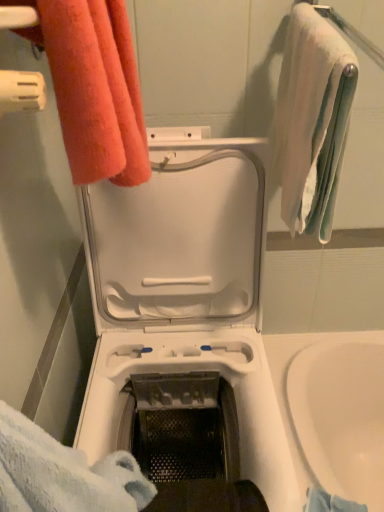
Measure the distance between point (109, 94) and camera.

The depth of point (109, 94) is 19.21 inches.

Measure the distance between white plastic washing machine at center and camera.

The distance of white plastic washing machine at center from camera is 66.30 centimeters.

Identify the location of white soft towel at upper right, which is counted as the 1th towel, starting from the right. (312, 120).

Does white soft towel at upper right, which is counted as the 1th towel, starting from the right, appear on the left side of orange terry cloth towel at upper left, the second towel in the right-to-left sequence?

Incorrect, white soft towel at upper right, which is counted as the 1th towel, starting from the right, is not on the left side of orange terry cloth towel at upper left, the second towel in the right-to-left sequence.

From the image's perspective, between white soft towel at upper right, arranged as the second towel when viewed from the left, and orange terry cloth towel at upper left, the second towel in the right-to-left sequence, which one is located above?

white soft towel at upper right, arranged as the second towel when viewed from the left.

Is white soft towel at upper right, arranged as the second towel when viewed from the left, in front of or behind orange terry cloth towel at upper left, positioned as the 1th towel in left-to-right order, in the image?

white soft towel at upper right, arranged as the second towel when viewed from the left, is positioned farther from the viewer than orange terry cloth towel at upper left, positioned as the 1th towel in left-to-right order.

Does point (339, 129) come farther from viewer compared to point (40, 15)?

Yes, point (339, 129) is behind point (40, 15).

From a real-world perspective, which object stands above the other?

white soft towel at upper right, which is counted as the 1th towel, starting from the right, is physically above.

Does point (197, 141) come farther from viewer compared to point (313, 106)?

Yes, point (197, 141) is farther from viewer.

From the image's perspective, which one is positioned higher, white plastic washing machine at center or white soft towel at upper right, which is counted as the 1th towel, starting from the right?

white soft towel at upper right, which is counted as the 1th towel, starting from the right, appears higher in the image.

Identify the location of the 1st towel above the white plastic washing machine at center (from a real-world perspective). This screenshot has height=512, width=384. (312, 120).

Is white plastic washing machine at center not inside orange terry cloth towel at upper left, the second towel in the right-to-left sequence?

Yes, white plastic washing machine at center is outside of orange terry cloth towel at upper left, the second towel in the right-to-left sequence.

Considering the relative sizes of white plastic washing machine at center and orange terry cloth towel at upper left, positioned as the 1th towel in left-to-right order, in the image provided, is white plastic washing machine at center wider than orange terry cloth towel at upper left, positioned as the 1th towel in left-to-right order,?

Correct, the width of white plastic washing machine at center exceeds that of orange terry cloth towel at upper left, positioned as the 1th towel in left-to-right order.

From a real-world perspective, who is located lower, white plastic washing machine at center or orange terry cloth towel at upper left, the second towel in the right-to-left sequence?

From a 3D spatial view, white plastic washing machine at center is below.

Is orange terry cloth towel at upper left, the second towel in the right-to-left sequence, at the back of white plastic washing machine at center?

white plastic washing machine at center is not turned away from orange terry cloth towel at upper left, the second towel in the right-to-left sequence.

Based on the photo, is orange terry cloth towel at upper left, the second towel in the right-to-left sequence, not within white plastic washing machine at center?

Absolutely, orange terry cloth towel at upper left, the second towel in the right-to-left sequence, is external to white plastic washing machine at center.

From the image's perspective, is orange terry cloth towel at upper left, positioned as the 1th towel in left-to-right order, located beneath white plastic washing machine at center?

Incorrect, from the image's perspective, orange terry cloth towel at upper left, positioned as the 1th towel in left-to-right order, is higher than white plastic washing machine at center.

Who is taller, orange terry cloth towel at upper left, positioned as the 1th towel in left-to-right order, or white plastic washing machine at center?

white plastic washing machine at center.

Is point (298, 216) less distant than point (241, 193)?

Yes, point (298, 216) is closer to viewer.

Considering the sizes of objects white soft towel at upper right, which is counted as the 1th towel, starting from the right, and white plastic washing machine at center in the image provided, who is bigger, white soft towel at upper right, which is counted as the 1th towel, starting from the right, or white plastic washing machine at center?

Bigger between the two is white plastic washing machine at center.

Considering their positions, is white soft towel at upper right, which is counted as the 1th towel, starting from the right, located in front of or behind white plastic washing machine at center?

white soft towel at upper right, which is counted as the 1th towel, starting from the right, is behind white plastic washing machine at center.

From a real-world perspective, who is located higher, white soft towel at upper right, arranged as the second towel when viewed from the left, or white plastic washing machine at center?

white soft towel at upper right, arranged as the second towel when viewed from the left.

What's the angular difference between orange terry cloth towel at upper left, positioned as the 1th towel in left-to-right order, and white soft towel at upper right, which is counted as the 1th towel, starting from the right,'s facing directions?

The angle between the facing direction of orange terry cloth towel at upper left, positioned as the 1th towel in left-to-right order, and the facing direction of white soft towel at upper right, which is counted as the 1th towel, starting from the right, is 9.14e-05 degrees.

Which point is more forward, (82,163) or (325,36)?

Positioned in front is point (82,163).

In the scene shown: Does orange terry cloth towel at upper left, the second towel in the right-to-left sequence, have a smaller size compared to white soft towel at upper right, which is counted as the 1th towel, starting from the right?

Indeed, orange terry cloth towel at upper left, the second towel in the right-to-left sequence, has a smaller size compared to white soft towel at upper right, which is counted as the 1th towel, starting from the right.

At what (x,y) coordinates should I click in order to perform the action: click on towel above the white soft towel at upper right, which is counted as the 1th towel, starting from the right (from a real-world perspective). Please return your answer as a coordinate pair (x, y). This screenshot has height=512, width=384. Looking at the image, I should click on (94, 87).

This screenshot has width=384, height=512. What are the coordinates of `washing machine lying below the white soft towel at upper right, which is counted as the 1th towel, starting from the right (from the image's perspective)` in the screenshot? It's located at (186, 330).

Estimate the real-world distances between objects in this image. Which object is closer to white plastic washing machine at center, white soft towel at upper right, arranged as the second towel when viewed from the left, or orange terry cloth towel at upper left, the second towel in the right-to-left sequence?

white soft towel at upper right, arranged as the second towel when viewed from the left, lies closer to white plastic washing machine at center than the other object.

From the image, which object appears to be farther from white soft towel at upper right, which is counted as the 1th towel, starting from the right, white plastic washing machine at center or orange terry cloth towel at upper left, positioned as the 1th towel in left-to-right order?

orange terry cloth towel at upper left, positioned as the 1th towel in left-to-right order, is further to white soft towel at upper right, which is counted as the 1th towel, starting from the right.

Estimate the real-world distances between objects in this image. Which object is closer to orange terry cloth towel at upper left, positioned as the 1th towel in left-to-right order, white soft towel at upper right, which is counted as the 1th towel, starting from the right, or white plastic washing machine at center?

white soft towel at upper right, which is counted as the 1th towel, starting from the right, is positioned closer to the anchor orange terry cloth towel at upper left, positioned as the 1th towel in left-to-right order.

Considering their positions, is white plastic washing machine at center positioned closer to orange terry cloth towel at upper left, positioned as the 1th towel in left-to-right order, than white soft towel at upper right, arranged as the second towel when viewed from the left?

white soft towel at upper right, arranged as the second towel when viewed from the left.

Estimate the real-world distances between objects in this image. Which object is further from white soft towel at upper right, which is counted as the 1th towel, starting from the right, orange terry cloth towel at upper left, positioned as the 1th towel in left-to-right order, or white plastic washing machine at center?

orange terry cloth towel at upper left, positioned as the 1th towel in left-to-right order, lies further to white soft towel at upper right, which is counted as the 1th towel, starting from the right, than the other object.

From the image, which object appears to be nearer to white plastic washing machine at center, orange terry cloth towel at upper left, the second towel in the right-to-left sequence, or white soft towel at upper right, arranged as the second towel when viewed from the left?

white soft towel at upper right, arranged as the second towel when viewed from the left.

Where is `towel between white soft towel at upper right, arranged as the second towel when viewed from the left, and white plastic washing machine at center vertically`? This screenshot has height=512, width=384. towel between white soft towel at upper right, arranged as the second towel when viewed from the left, and white plastic washing machine at center vertically is located at coordinates (94, 87).